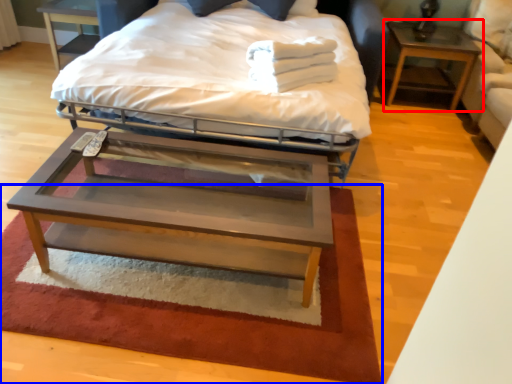
Question: Which point is closer to the camera, nightstand (highlighted by a red box) or mat (highlighted by a blue box)?

Choices:
 (A) nightstand
 (B) mat

Answer: (B)